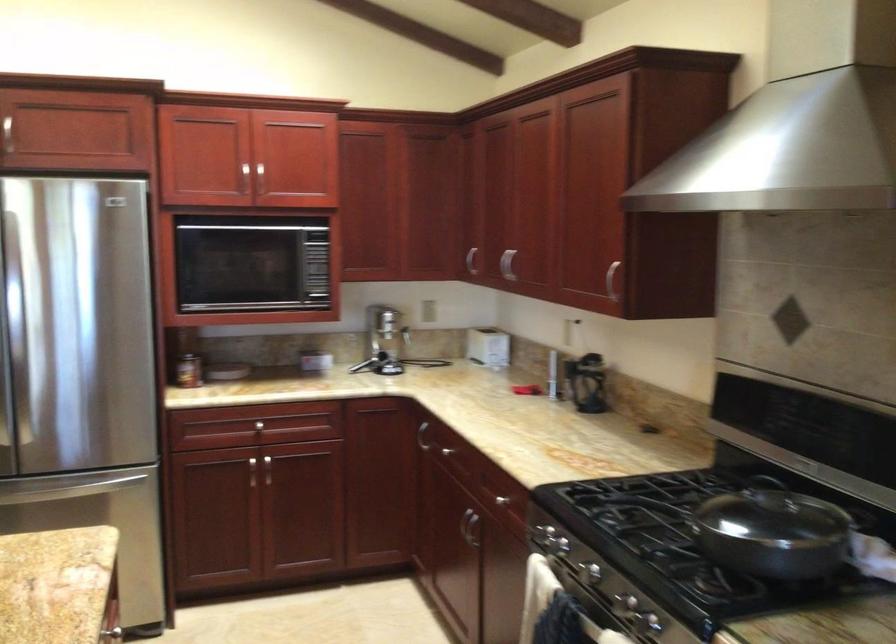
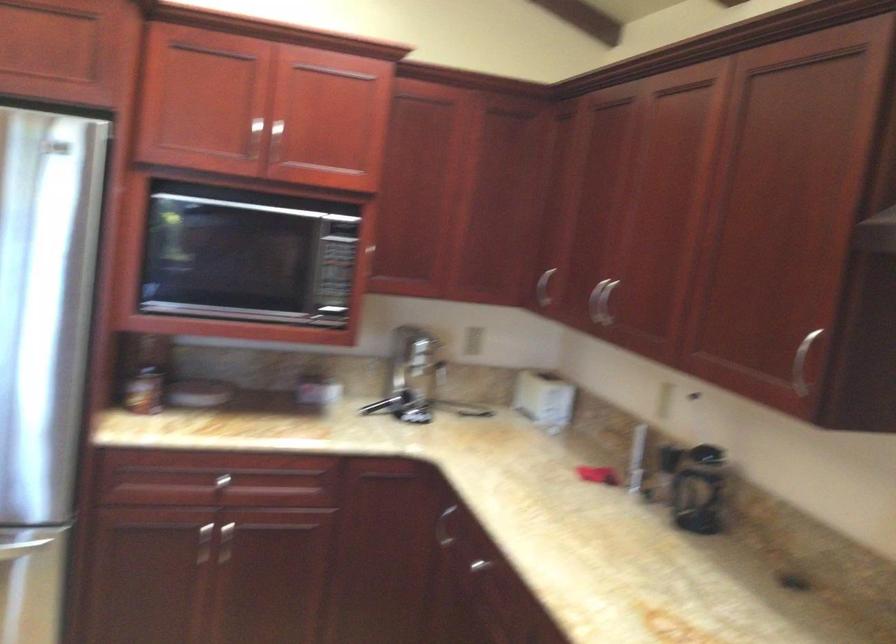
The point at [225,373] is marked in the first image. Where is the corresponding point in the second image?

(197, 393)